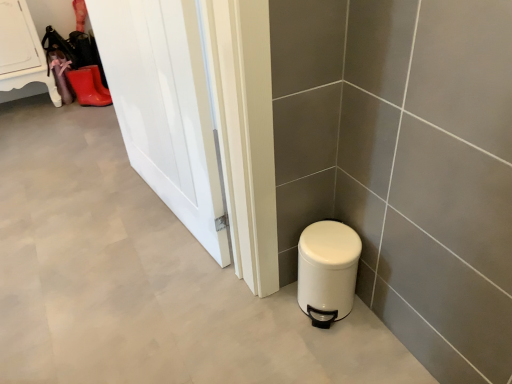
Identify the location of blank area to the left of white glossy door at left. (84, 207).